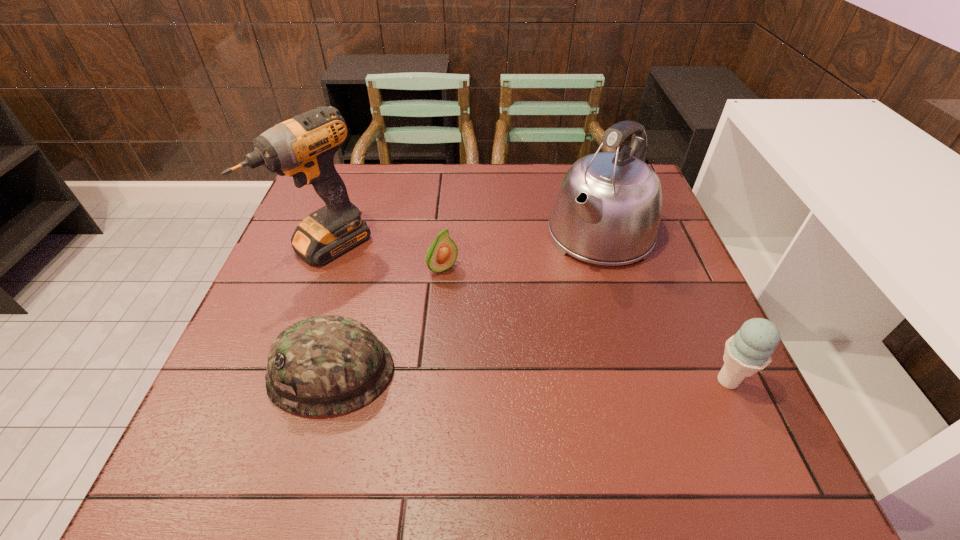
Identify the location of vacant space on the desktop that is between the headwear and the third tallest object and is positioned on the spout of the kettle. click(x=482, y=375).

Locate an element on the screen. vacant spot on the desktop that is between the headwear and the ice cream and is positioned on the cut side of the third object from left to right is located at coordinates pos(548,377).

Find the location of a particular element. vacant space on the desktop that is between the headwear and the ice cream and is positioned with the drill bit of the drill facing forward is located at coordinates (x=497, y=376).